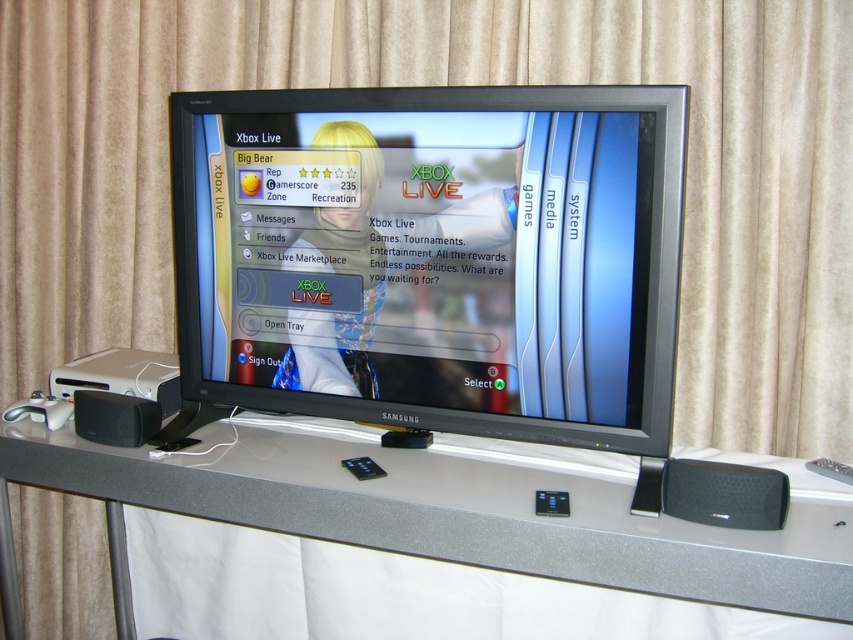
Is white glossy table at center wider than black mesh speaker at lower right?

Yes.

The height and width of the screenshot is (640, 853). What do you see at coordinates (448, 515) in the screenshot?
I see `white glossy table at center` at bounding box center [448, 515].

Identify the location of white glossy table at center. The image size is (853, 640). (448, 515).

Is matte black monitor at center closer to camera compared to black plastic speaker at lower left?

Yes, it is in front of black plastic speaker at lower left.

Is matte black monitor at center thinner than black plastic speaker at lower left?

No, matte black monitor at center is not thinner than black plastic speaker at lower left.

Is point (231, 221) closer to viewer compared to point (91, 419)?

No, (231, 221) is behind (91, 419).

I want to click on matte black monitor at center, so click(x=428, y=257).

Can you confirm if white glossy table at center is bigger than black plastic speaker at lower left?

Indeed, white glossy table at center has a larger size compared to black plastic speaker at lower left.

Can you confirm if white glossy table at center is positioned below black plastic speaker at lower left?

Yes.

Which is behind, point (283, 445) or point (90, 422)?

The point (90, 422) is more distant.

You are a GUI agent. You are given a task and a screenshot of the screen. Output one action in this format:
    pyautogui.click(x=<x>, y=<y>)
    Task: Click on the white glossy table at center
    
    Given the screenshot: What is the action you would take?
    pyautogui.click(x=448, y=515)